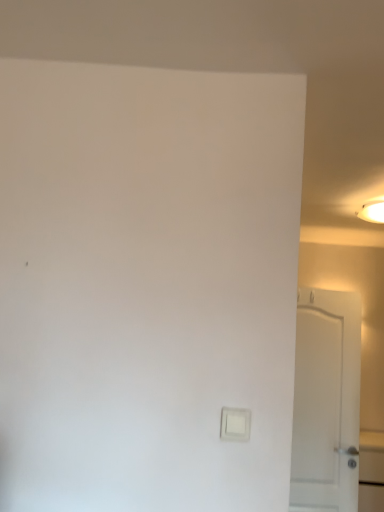
Question: Is white matte door at right shorter than white glossy light fixture at upper right?

Choices:
 (A) yes
 (B) no

Answer: (B)

Question: Is white matte door at right facing towards white glossy light fixture at upper right?

Choices:
 (A) no
 (B) yes

Answer: (A)

Question: Is the position of white matte door at right more distant than that of white glossy light fixture at upper right?

Choices:
 (A) yes
 (B) no

Answer: (B)

Question: Is white glossy light fixture at upper right a part of white matte door at right?

Choices:
 (A) yes
 (B) no

Answer: (B)

Question: Is white matte door at right next to white glossy light fixture at upper right?

Choices:
 (A) yes
 (B) no

Answer: (B)

Question: Considering the relative positions of white matte door at right and white glossy light fixture at upper right in the image provided, is white matte door at right to the right of white glossy light fixture at upper right from the viewer's perspective?

Choices:
 (A) no
 (B) yes

Answer: (A)

Question: From a real-world perspective, is white plastic light switch at lower center beneath white glossy light fixture at upper right?

Choices:
 (A) yes
 (B) no

Answer: (A)

Question: Considering the relative sizes of white plastic light switch at lower center and white glossy light fixture at upper right in the image provided, is white plastic light switch at lower center shorter than white glossy light fixture at upper right?

Choices:
 (A) no
 (B) yes

Answer: (B)

Question: Is white plastic light switch at lower center placed right next to white glossy light fixture at upper right?

Choices:
 (A) no
 (B) yes

Answer: (A)

Question: Can you confirm if white plastic light switch at lower center is smaller than white glossy light fixture at upper right?

Choices:
 (A) no
 (B) yes

Answer: (B)

Question: Can you confirm if white plastic light switch at lower center is wider than white glossy light fixture at upper right?

Choices:
 (A) yes
 (B) no

Answer: (B)

Question: From the image's perspective, would you say white plastic light switch at lower center is positioned over white glossy light fixture at upper right?

Choices:
 (A) yes
 (B) no

Answer: (B)

Question: Is white matte door at right bigger than white plastic light switch at lower center?

Choices:
 (A) yes
 (B) no

Answer: (A)